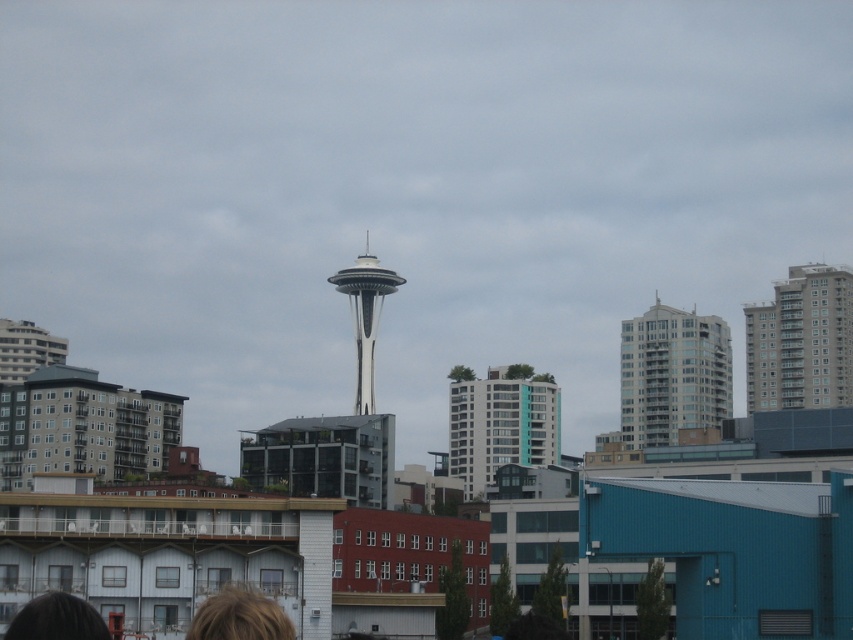
Is point (641, 380) in front of point (198, 616)?

No, it is not.

Looking at this image, can you confirm if glassy white building at center is wider than blonde hair at lower center?

Yes, glassy white building at center is wider than blonde hair at lower center.

Who is more distant from viewer, [630,372] or [198,609]?

Point [630,372]

Locate an element on the screen. The image size is (853, 640). glassy white building at center is located at coordinates (672, 374).

Who is shorter, gray concrete building at upper right or white glass building at center?

white glass building at center is shorter.

Is point (815, 324) positioned behind point (531, 404)?

That is False.

This screenshot has height=640, width=853. I want to click on gray concrete building at upper right, so click(x=801, y=340).

Is white glass building at center further to the viewer compared to blonde hair at lower center?

Yes, it is behind blonde hair at lower center.

Which is behind, point (508, 388) or point (289, 621)?

Point (508, 388)

Find the location of `white glass building at center`. white glass building at center is located at coordinates (500, 426).